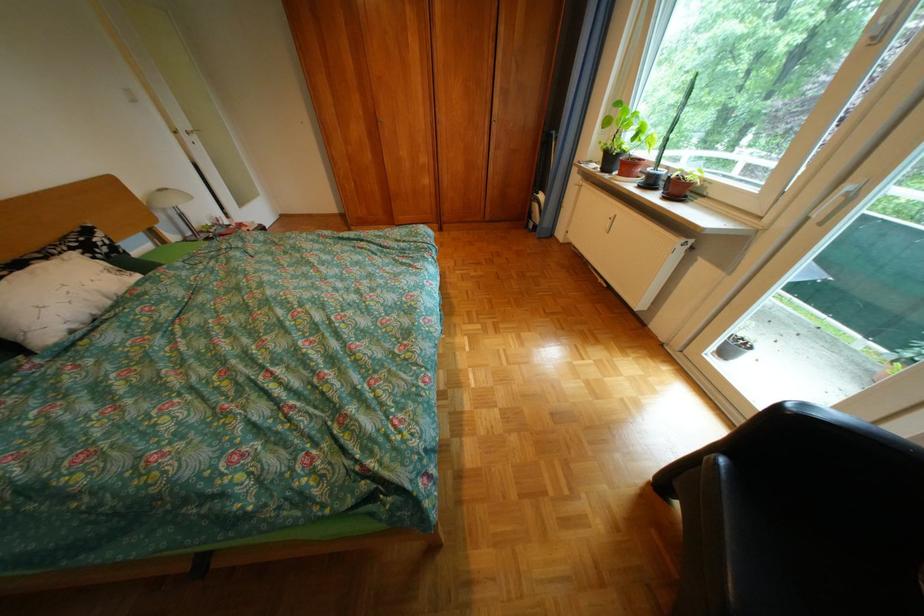
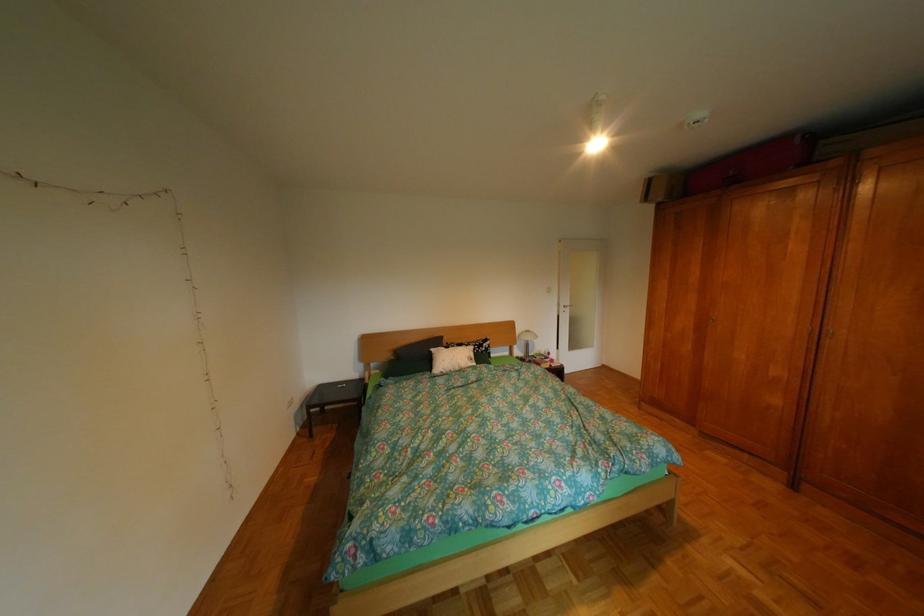
In the second image, find the point that corresponds to point (156, 236) in the first image.

(523, 349)